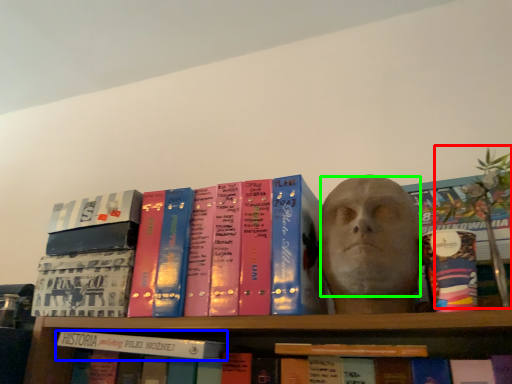
Question: Which is nearer to the plant (highlighted by a red box)? book (highlighted by a blue box) or human face (highlighted by a green box).

Choices:
 (A) book
 (B) human face

Answer: (B)